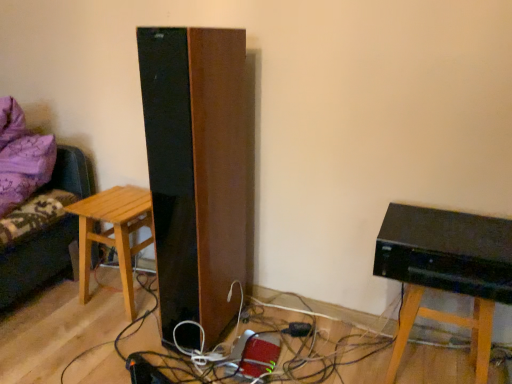
Image resolution: width=512 pixels, height=384 pixels. I want to click on free space to the left of black plastic plug at lower center, so click(259, 331).